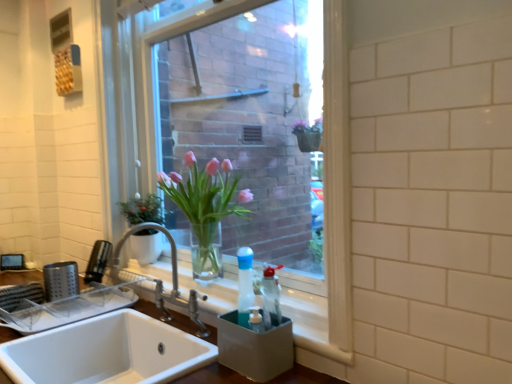
This screenshot has height=384, width=512. What do you see at coordinates (244, 140) in the screenshot? I see `clear glass vase at center` at bounding box center [244, 140].

Image resolution: width=512 pixels, height=384 pixels. Describe the element at coordinates (109, 353) in the screenshot. I see `white ceramic sink at lower left, placed as the second sink when sorted from top to bottom` at that location.

Locate an element on the screen. Image resolution: width=512 pixels, height=384 pixels. clear glass vase at center is located at coordinates (244, 140).

Is satin nickel faucet at sink left oriented towards white ceramic sink at lower left, acting as the first sink starting from the top?

No, satin nickel faucet at sink left does not turn towards white ceramic sink at lower left, acting as the first sink starting from the top.

Measure the distance from satin nickel faucet at sink left to white ceramic sink at lower left, acting as the first sink starting from the top.

The distance of satin nickel faucet at sink left from white ceramic sink at lower left, acting as the first sink starting from the top, is 21.79 centimeters.

Considering the sizes of objects satin nickel faucet at sink left and white ceramic sink at lower left, the second sink when ordered from bottom to top, in the image provided, who is shorter, satin nickel faucet at sink left or white ceramic sink at lower left, the second sink when ordered from bottom to top,?

white ceramic sink at lower left, the second sink when ordered from bottom to top.

Between satin nickel faucet at sink left and white ceramic sink at lower left, the second sink when ordered from bottom to top, which one appears on the right side from the viewer's perspective?

satin nickel faucet at sink left is more to the right.

What's the angular difference between pink glass vase at center and satin nickel faucet at sink left's facing directions?

The facing directions of pink glass vase at center and satin nickel faucet at sink left are 1.54 degrees apart.

Considering the points (216, 210) and (164, 296), which point is behind, point (216, 210) or point (164, 296)?

The point (164, 296) is farther.

Is pink glass vase at center inside the boundaries of satin nickel faucet at sink left, or outside?

pink glass vase at center lies outside satin nickel faucet at sink left.

Is point (54, 381) closer or farther from the camera than point (291, 231)?

Clearly, point (54, 381) is closer to the camera than point (291, 231).

Is white ceramic sink at lower left, the second sink when ordered from bottom to top, bigger than clear glass vase at center?

No, white ceramic sink at lower left, the second sink when ordered from bottom to top, is not bigger than clear glass vase at center.

Is white ceramic sink at lower left, acting as the first sink starting from the top, at the right side of clear glass vase at center?

Incorrect, white ceramic sink at lower left, acting as the first sink starting from the top, is not on the right side of clear glass vase at center.

Which is correct: white ceramic sink at lower left, acting as the first sink starting from the top, is inside clear glass vase at center, or outside of it?

white ceramic sink at lower left, acting as the first sink starting from the top, is not inside clear glass vase at center, it's outside.

Looking at this image, considering the relative positions of satin nickel faucet at sink left and white ceramic sink at lower left, placed as the second sink when sorted from top to bottom, in the image provided, is satin nickel faucet at sink left to the right of white ceramic sink at lower left, placed as the second sink when sorted from top to bottom, from the viewer's perspective?

Yes.

From the image's perspective, between satin nickel faucet at sink left and white ceramic sink at lower left, which is the first sink in bottom-to-top order, which one is located above?

satin nickel faucet at sink left is shown above in the image.

Between satin nickel faucet at sink left and white ceramic sink at lower left, placed as the second sink when sorted from top to bottom, which one is positioned behind?

satin nickel faucet at sink left is more distant.

What's the angular difference between satin nickel faucet at sink left and white ceramic sink at lower left, placed as the second sink when sorted from top to bottom,'s facing directions?

The facing directions of satin nickel faucet at sink left and white ceramic sink at lower left, placed as the second sink when sorted from top to bottom, are 0.611 degrees apart.

Considering the relative sizes of white ceramic sink at lower left, placed as the second sink when sorted from top to bottom, and white ceramic sink at lower left, the second sink when ordered from bottom to top, in the image provided, is white ceramic sink at lower left, placed as the second sink when sorted from top to bottom, shorter than white ceramic sink at lower left, the second sink when ordered from bottom to top,?

No.

From the image's perspective, which one is positioned lower, white ceramic sink at lower left, which is the first sink in bottom-to-top order, or white ceramic sink at lower left, acting as the first sink starting from the top?

white ceramic sink at lower left, which is the first sink in bottom-to-top order, appears lower in the image.

Between white ceramic sink at lower left, which is the first sink in bottom-to-top order, and white ceramic sink at lower left, the second sink when ordered from bottom to top, which one has smaller width?

white ceramic sink at lower left, the second sink when ordered from bottom to top, is thinner.

How different are the orientations of white ceramic sink at lower left, which is the first sink in bottom-to-top order, and satin nickel faucet at sink left in degrees?

0.611 degrees separate the facing orientations of white ceramic sink at lower left, which is the first sink in bottom-to-top order, and satin nickel faucet at sink left.

Is white ceramic sink at lower left, which is the first sink in bottom-to-top order, next to satin nickel faucet at sink left?

white ceramic sink at lower left, which is the first sink in bottom-to-top order, is not next to satin nickel faucet at sink left, and they're not touching.

From the image's perspective, which object appears higher, white ceramic sink at lower left, which is the first sink in bottom-to-top order, or satin nickel faucet at sink left?

satin nickel faucet at sink left is shown above in the image.

From a real-world perspective, is white ceramic sink at lower left, placed as the second sink when sorted from top to bottom, under satin nickel faucet at sink left?

Correct, in the physical world, white ceramic sink at lower left, placed as the second sink when sorted from top to bottom, is lower than satin nickel faucet at sink left.

Considering the relative sizes of pink glass vase at center and white ceramic sink at lower left, the second sink when ordered from bottom to top, in the image provided, is pink glass vase at center thinner than white ceramic sink at lower left, the second sink when ordered from bottom to top,?

Yes, pink glass vase at center is thinner than white ceramic sink at lower left, the second sink when ordered from bottom to top.

Could you measure the distance between pink glass vase at center and white ceramic sink at lower left, the second sink when ordered from bottom to top?

pink glass vase at center is 16.98 inches away from white ceramic sink at lower left, the second sink when ordered from bottom to top.

From a real-world perspective, between pink glass vase at center and white ceramic sink at lower left, the second sink when ordered from bottom to top, who is vertically higher?

pink glass vase at center is physically above.

Where is `tap that is above the white ceramic sink at lower left, the second sink when ordered from bottom to top (from a real-world perspective)`? This screenshot has height=384, width=512. tap that is above the white ceramic sink at lower left, the second sink when ordered from bottom to top (from a real-world perspective) is located at coordinates (172, 281).

Where is `floral arrangement on the right of satin nickel faucet at sink left`? Image resolution: width=512 pixels, height=384 pixels. floral arrangement on the right of satin nickel faucet at sink left is located at coordinates (203, 204).

Considering their positions, is clear glass vase at center positioned further to pink glass vase at center than white ceramic sink at lower left, placed as the second sink when sorted from top to bottom?

The object further to pink glass vase at center is clear glass vase at center.

Considering their positions, is satin nickel faucet at sink left positioned further to clear glass vase at center than white ceramic sink at lower left, placed as the second sink when sorted from top to bottom?

satin nickel faucet at sink left.

Looking at the image, which one is located further to satin nickel faucet at sink left, pink glass vase at center or white ceramic sink at lower left, acting as the first sink starting from the top?

Based on the image, white ceramic sink at lower left, acting as the first sink starting from the top, appears to be further to satin nickel faucet at sink left.

From the image, which object appears to be farther from white ceramic sink at lower left, acting as the first sink starting from the top, clear glass vase at center or pink glass vase at center?

clear glass vase at center lies further to white ceramic sink at lower left, acting as the first sink starting from the top, than the other object.

Based on their spatial positions, is white ceramic sink at lower left, placed as the second sink when sorted from top to bottom, or satin nickel faucet at sink left closer to clear glass vase at center?

white ceramic sink at lower left, placed as the second sink when sorted from top to bottom, is positioned closer to the anchor clear glass vase at center.

Which object lies further to the anchor point white ceramic sink at lower left, acting as the first sink starting from the top, satin nickel faucet at sink left or clear glass vase at center?

clear glass vase at center.

Considering their positions, is pink glass vase at center positioned closer to white ceramic sink at lower left, the second sink when ordered from bottom to top, than clear glass vase at center?

pink glass vase at center.

Estimate the real-world distances between objects in this image. Which object is closer to white ceramic sink at lower left, placed as the second sink when sorted from top to bottom, clear glass vase at center or satin nickel faucet at sink left?

satin nickel faucet at sink left is closer to white ceramic sink at lower left, placed as the second sink when sorted from top to bottom.

Image resolution: width=512 pixels, height=384 pixels. I want to click on floral arrangement between clear glass vase at center and white ceramic sink at lower left, placed as the second sink when sorted from top to bottom, in the up-down direction, so click(x=203, y=204).

Where is `tap between pink glass vase at center and white ceramic sink at lower left, which is the first sink in bottom-to-top order, vertically`? The height and width of the screenshot is (384, 512). tap between pink glass vase at center and white ceramic sink at lower left, which is the first sink in bottom-to-top order, vertically is located at coordinates (172, 281).

You are a GUI agent. You are given a task and a screenshot of the screen. Output one action in this format:
    pyautogui.click(x=<x>, y=<y>)
    Task: Click on the floral arrangement between clear glass vase at center and satin nickel faucet at sink left from top to bottom
    The height and width of the screenshot is (384, 512).
    Given the screenshot: What is the action you would take?
    pyautogui.click(x=203, y=204)

The height and width of the screenshot is (384, 512). I want to click on sink between satin nickel faucet at sink left and white ceramic sink at lower left, which is the first sink in bottom-to-top order, in the vertical direction, so click(x=106, y=352).